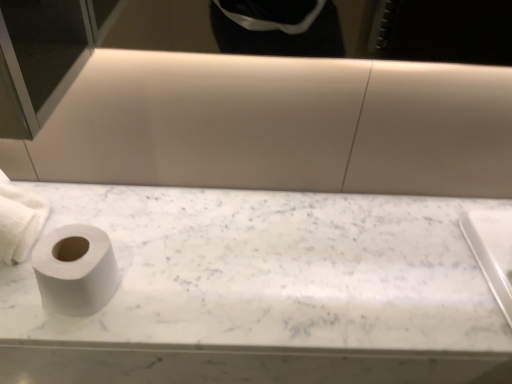
The width and height of the screenshot is (512, 384). I want to click on free space behind white matte toilet paper at left, which appears as the 1th toilet paper when viewed from the right, so click(127, 214).